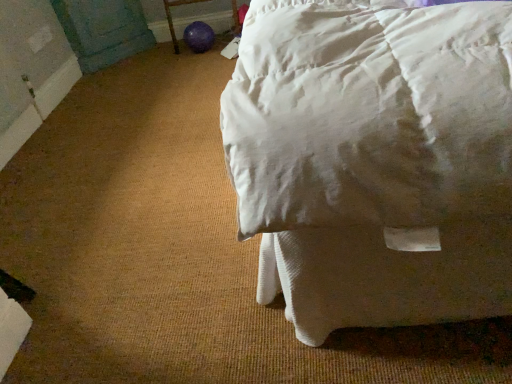
Question: From the image's perspective, is purple rubber ball at lower center beneath white cotton bed at upper right?

Choices:
 (A) yes
 (B) no

Answer: (B)

Question: From a real-world perspective, is purple rubber ball at lower center on white cotton bed at upper right?

Choices:
 (A) yes
 (B) no

Answer: (A)

Question: Would you say purple rubber ball at lower center is outside white cotton bed at upper right?

Choices:
 (A) no
 (B) yes

Answer: (B)

Question: Is purple rubber ball at lower center bigger than white cotton bed at upper right?

Choices:
 (A) yes
 (B) no

Answer: (B)

Question: Does purple rubber ball at lower center have a lesser width compared to white cotton bed at upper right?

Choices:
 (A) no
 (B) yes

Answer: (B)

Question: Can you confirm if purple rubber ball at lower center is taller than white cotton bed at upper right?

Choices:
 (A) no
 (B) yes

Answer: (B)

Question: Would you say white cotton bed at upper right is a long distance from purple rubber ball at lower center?

Choices:
 (A) no
 (B) yes

Answer: (B)

Question: Does white cotton bed at upper right turn towards purple rubber ball at lower center?

Choices:
 (A) no
 (B) yes

Answer: (A)

Question: Is white cotton bed at upper right positioned beyond the bounds of purple rubber ball at lower center?

Choices:
 (A) no
 (B) yes

Answer: (B)

Question: Can you confirm if white cotton bed at upper right is smaller than purple rubber ball at lower center?

Choices:
 (A) no
 (B) yes

Answer: (A)

Question: Is white cotton bed at upper right oriented away from purple rubber ball at lower center?

Choices:
 (A) yes
 (B) no

Answer: (B)

Question: Does white cotton bed at upper right appear on the right side of purple rubber ball at lower center?

Choices:
 (A) no
 (B) yes

Answer: (B)

Question: From the image's perspective, is purple rubber ball at lower center positioned above or below white cotton bed at upper right?

Choices:
 (A) below
 (B) above

Answer: (B)